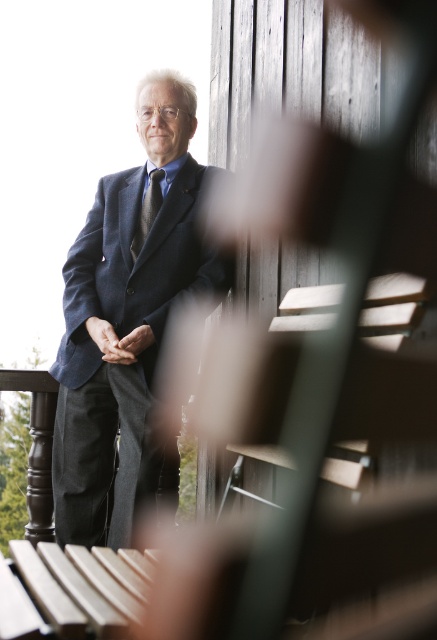
Who is positioned more to the left, dark blue suit at center or dark gray textured tie at center?

From the viewer's perspective, dark blue suit at center appears more on the left side.

Image resolution: width=437 pixels, height=640 pixels. What do you see at coordinates (128, 326) in the screenshot? I see `dark blue suit at center` at bounding box center [128, 326].

Where is `dark blue suit at center`? dark blue suit at center is located at coordinates (128, 326).

I want to click on dark blue suit at center, so pyautogui.click(x=128, y=326).